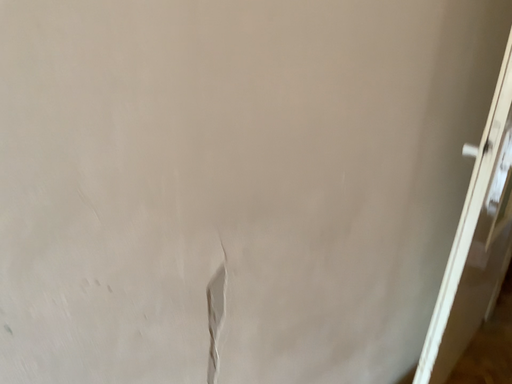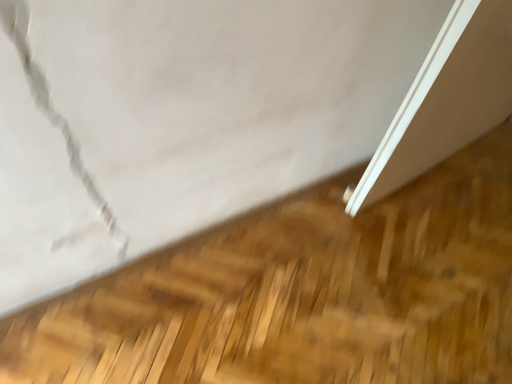
Question: Which way did the camera rotate in the video?

Choices:
 (A) rotated upward
 (B) rotated downward

Answer: (B)